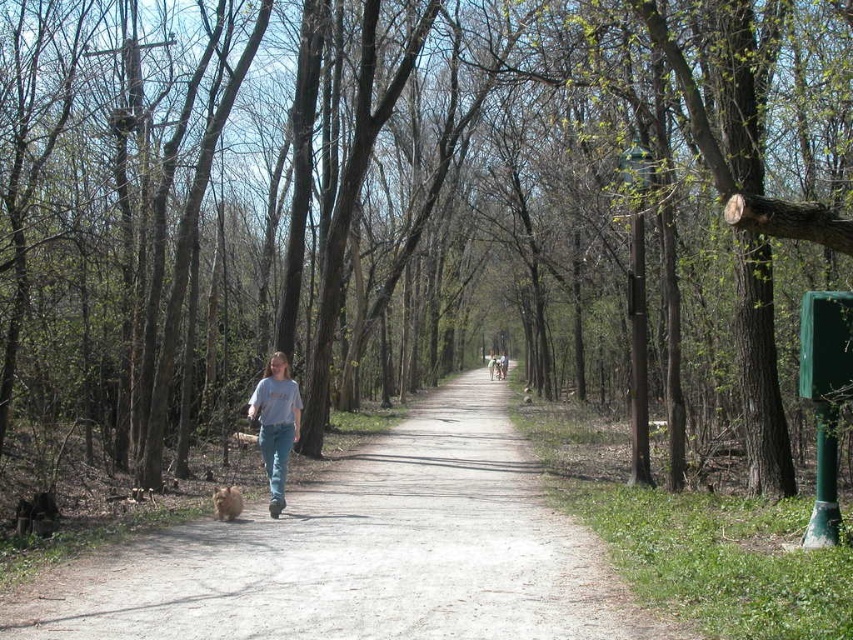
From the picture: Which of these two, dirt path at center or light blue jeans at center, stands taller?

light blue jeans at center

Between point (303, 525) and point (297, 394), which one is positioned in front?

Point (303, 525)

This screenshot has width=853, height=640. Find the location of `dirt path at center`. dirt path at center is located at coordinates click(364, 554).